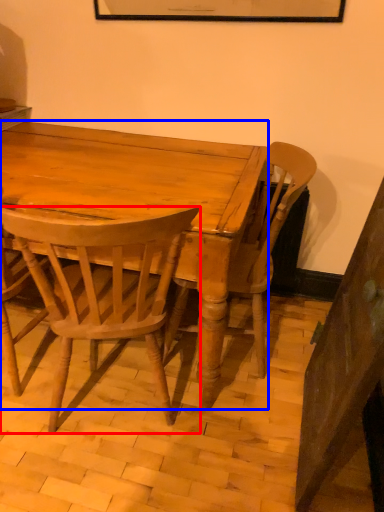
Question: Which point is closer to the camera, chair (highlighted by a red box) or desk (highlighted by a blue box)?

Choices:
 (A) chair
 (B) desk

Answer: (A)